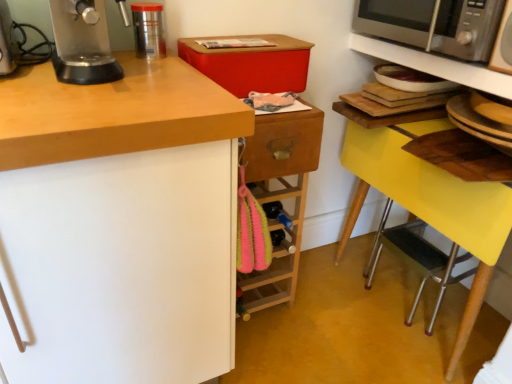
Find the location of a particular element. This screenshot has width=512, height=384. free location to the left of yellow wood table at lower right is located at coordinates (318, 312).